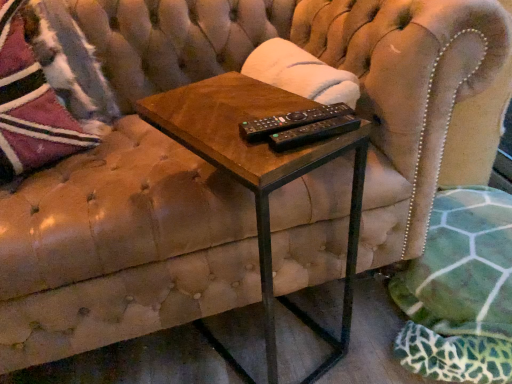
Question: Is woodenmaterial/texturetable at center outside black plastic remote controls at center?

Choices:
 (A) yes
 (B) no

Answer: (A)

Question: Is there a large distance between woodenmaterial/texturetable at center and black plastic remote controls at center?

Choices:
 (A) no
 (B) yes

Answer: (A)

Question: Does woodenmaterial/texturetable at center appear on the left side of black plastic remote controls at center?

Choices:
 (A) no
 (B) yes

Answer: (B)

Question: From a real-world perspective, does woodenmaterial/texturetable at center sit lower than black plastic remote controls at center?

Choices:
 (A) no
 (B) yes

Answer: (B)

Question: Is woodenmaterial/texturetable at center to the right of black plastic remote controls at center from the viewer's perspective?

Choices:
 (A) yes
 (B) no

Answer: (B)

Question: From the image's perspective, is woodenmaterial/texturetable at center over black plastic remote controls at center?

Choices:
 (A) yes
 (B) no

Answer: (B)

Question: Is black plastic remote at center further to camera compared to black plastic remote controls at center?

Choices:
 (A) no
 (B) yes

Answer: (A)

Question: From the image's perspective, is black plastic remote at center beneath black plastic remote controls at center?

Choices:
 (A) no
 (B) yes

Answer: (B)

Question: From a real-world perspective, is black plastic remote at center over black plastic remote controls at center?

Choices:
 (A) yes
 (B) no

Answer: (A)

Question: Does black plastic remote at center have a greater height compared to black plastic remote controls at center?

Choices:
 (A) yes
 (B) no

Answer: (B)

Question: Is black plastic remote at center at the right side of black plastic remote controls at center?

Choices:
 (A) no
 (B) yes

Answer: (B)

Question: Can you confirm if black plastic remote at center is wider than black plastic remote controls at center?

Choices:
 (A) no
 (B) yes

Answer: (A)

Question: Is woodenmaterial/texturetable at center at the back of velvet textured throw pillow at upper left?

Choices:
 (A) yes
 (B) no

Answer: (B)